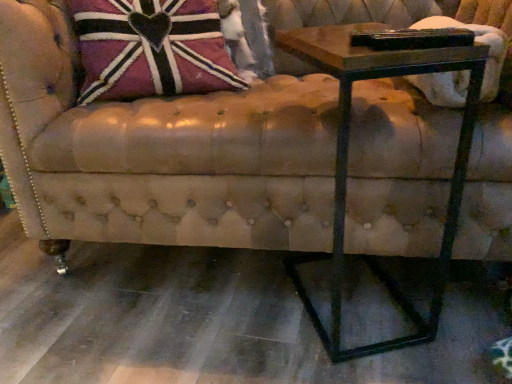
Question: Is leather-like union jack pillow at upper left further to the viewer compared to leather couch at center?

Choices:
 (A) yes
 (B) no

Answer: (A)

Question: Considering the relative sizes of leather-like union jack pillow at upper left and leather couch at center in the image provided, is leather-like union jack pillow at upper left shorter than leather couch at center?

Choices:
 (A) yes
 (B) no

Answer: (A)

Question: Is leather-like union jack pillow at upper left outside leather couch at center?

Choices:
 (A) yes
 (B) no

Answer: (B)

Question: Considering the relative sizes of leather-like union jack pillow at upper left and leather couch at center in the image provided, is leather-like union jack pillow at upper left wider than leather couch at center?

Choices:
 (A) yes
 (B) no

Answer: (B)

Question: Is leather-like union jack pillow at upper left touching leather couch at center?

Choices:
 (A) yes
 (B) no

Answer: (B)

Question: Does leather-like union jack pillow at upper left appear on the left side of leather couch at center?

Choices:
 (A) no
 (B) yes

Answer: (B)

Question: From a real-world perspective, is leather couch at center physically below wooden table at right?

Choices:
 (A) yes
 (B) no

Answer: (B)

Question: Considering the relative sizes of leather couch at center and wooden table at right in the image provided, is leather couch at center taller than wooden table at right?

Choices:
 (A) yes
 (B) no

Answer: (A)

Question: Would you say leather couch at center contains wooden table at right?

Choices:
 (A) yes
 (B) no

Answer: (A)

Question: From the image's perspective, is leather couch at center on wooden table at right?

Choices:
 (A) yes
 (B) no

Answer: (A)

Question: Is leather couch at center bigger than wooden table at right?

Choices:
 (A) no
 (B) yes

Answer: (B)

Question: Is leather couch at center looking in the opposite direction of wooden table at right?

Choices:
 (A) no
 (B) yes

Answer: (B)

Question: Considering the relative sizes of wooden table at right and leather-like union jack pillow at upper left in the image provided, is wooden table at right wider than leather-like union jack pillow at upper left?

Choices:
 (A) no
 (B) yes

Answer: (B)